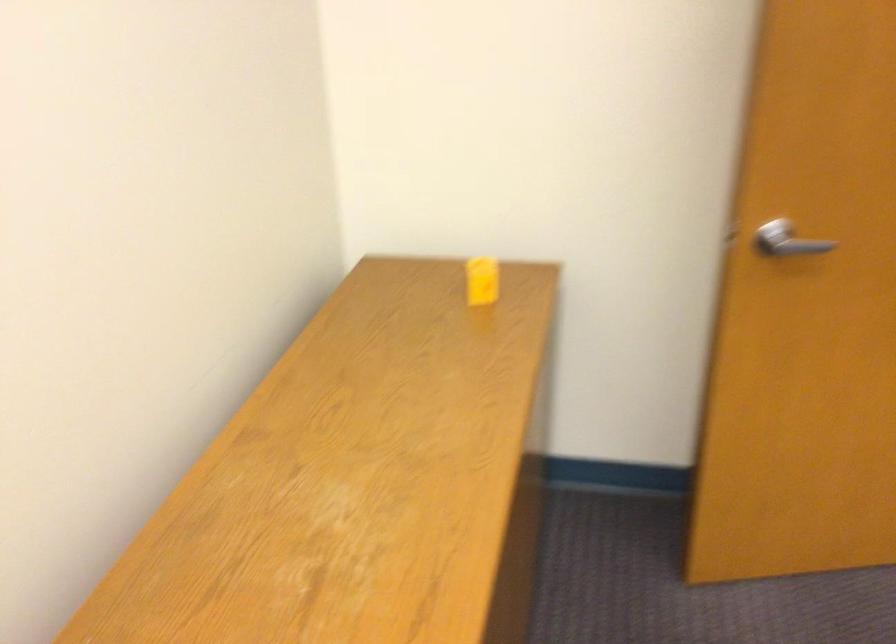
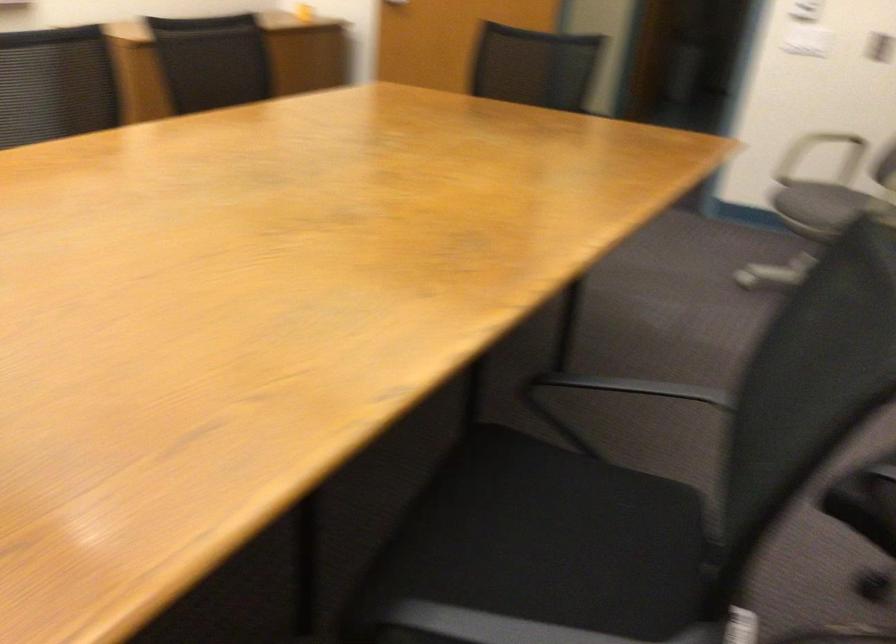
What movement of the cameraman would produce the second image?

The cameraman walked toward right, backward.